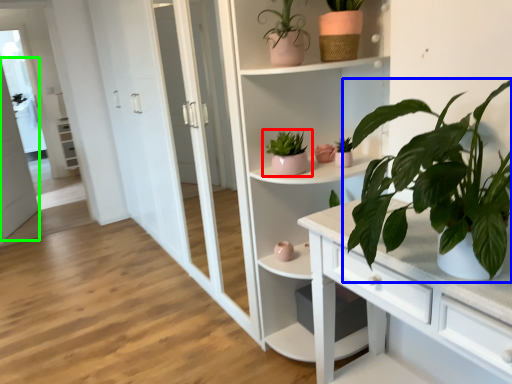
Question: Which is farther away from houseplant (highlighted by a red box)? houseplant (highlighted by a blue box) or screen door (highlighted by a green box)?

Choices:
 (A) houseplant
 (B) screen door

Answer: (B)